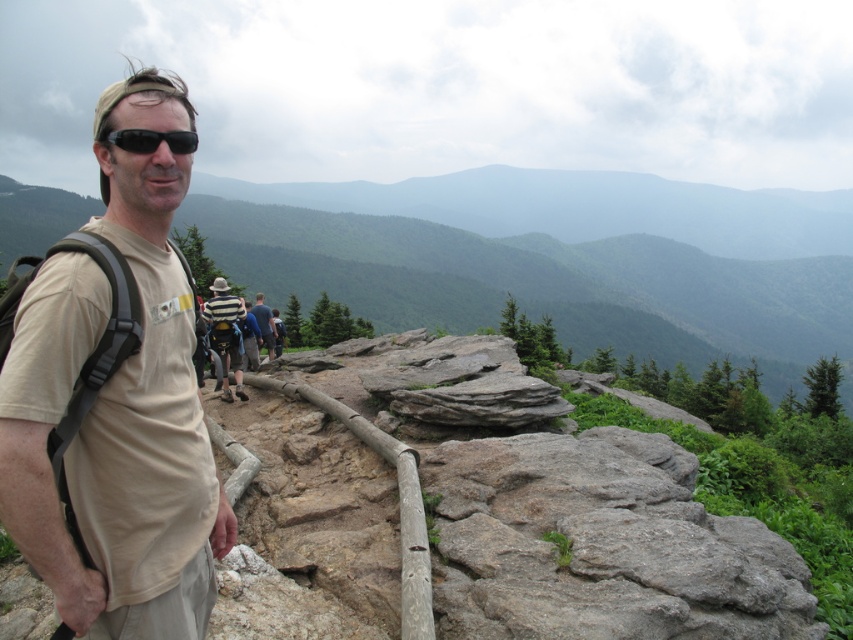
Question: Among these points, which one is nearest to the camera?

Choices:
 (A) (265, 332)
 (B) (194, 140)

Answer: (B)

Question: Is rocky terrain at left positioned before black matte sunglasses at center?

Choices:
 (A) no
 (B) yes

Answer: (A)

Question: Can you confirm if tan fabric shirt at left is smaller than blue striped shirt at center?

Choices:
 (A) yes
 (B) no

Answer: (A)

Question: Which object is the closest to the rocky terrain at left?

Choices:
 (A) striped cotton shirt at center
 (B) tan fabric shirt at left
 (C) blue striped shirt at center

Answer: (C)

Question: Is tan fabric shirt at left wider than black matte sunglasses at center?

Choices:
 (A) yes
 (B) no

Answer: (A)

Question: Which point is farther to the camera?

Choices:
 (A) (488, 285)
 (B) (177, 140)
 (C) (274, 337)

Answer: (A)